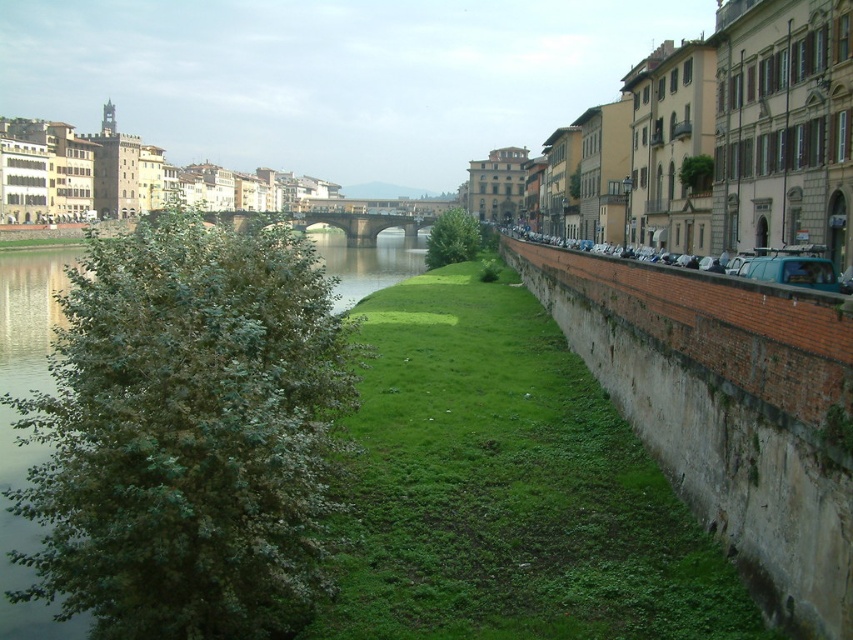
Question: Which of the following is the farthest from the observer?

Choices:
 (A) (421, 525)
 (B) (218, 572)

Answer: (A)

Question: Estimate the real-world distances between objects in this image. Which object is closer to the green leafy tree at left?

Choices:
 (A) green leafy tree at center
 (B) green grassy at center

Answer: (B)

Question: Based on their relative distances, which object is nearer to the green leafy tree at center?

Choices:
 (A) green leafy tree at left
 (B) green grassy at center

Answer: (B)

Question: Is green leafy tree at left to the right of green grassy at center from the viewer's perspective?

Choices:
 (A) no
 (B) yes

Answer: (A)

Question: From the image, what is the correct spatial relationship of green leafy tree at left in relation to green leafy tree at center?

Choices:
 (A) right
 (B) left

Answer: (B)

Question: Can you confirm if green leafy tree at left is wider than green leafy tree at center?

Choices:
 (A) no
 (B) yes

Answer: (B)